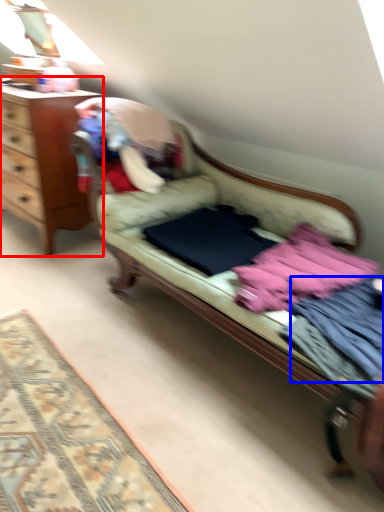
Question: Among these objects, which one is nearest to the camera, desk (highlighted by a red box) or clothing (highlighted by a blue box)?

Choices:
 (A) desk
 (B) clothing

Answer: (B)